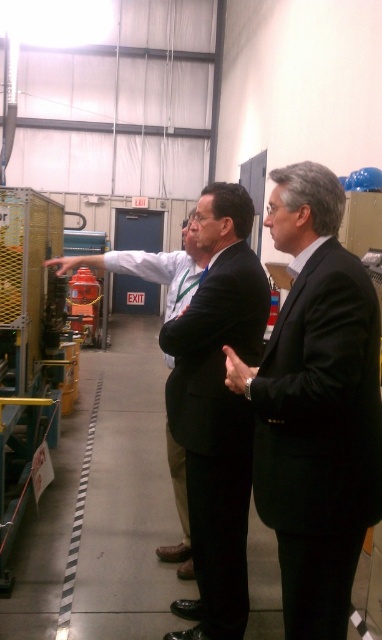
Question: Is matte black suit at center below dark suit at center?

Choices:
 (A) no
 (B) yes

Answer: (A)

Question: Estimate the real-world distances between objects in this image. Which object is closer to the matte black suit at center?

Choices:
 (A) smooth yellow hand at center
 (B) black suit at center

Answer: (B)

Question: Which point is closer to the camera?

Choices:
 (A) 239,368
 (B) 173,470
 (C) 323,195

Answer: (C)

Question: Does black suit at center appear under dark suit at center?

Choices:
 (A) yes
 (B) no

Answer: (B)

Question: Can you confirm if black suit at center is positioned to the right of matte black suit at center?

Choices:
 (A) no
 (B) yes

Answer: (B)

Question: Among these points, which one is farthest from the camera?

Choices:
 (A) (210, 337)
 (B) (320, 404)

Answer: (A)